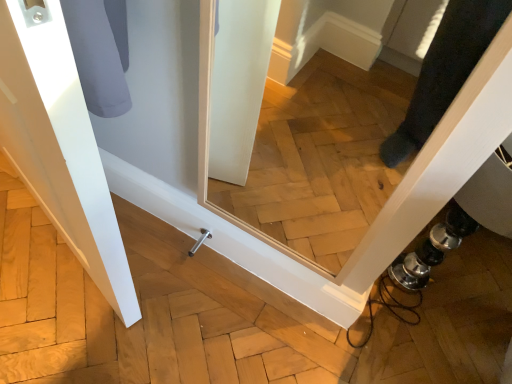
Where is `vacant space to the right of white matte door at left`? vacant space to the right of white matte door at left is located at coordinates (185, 294).